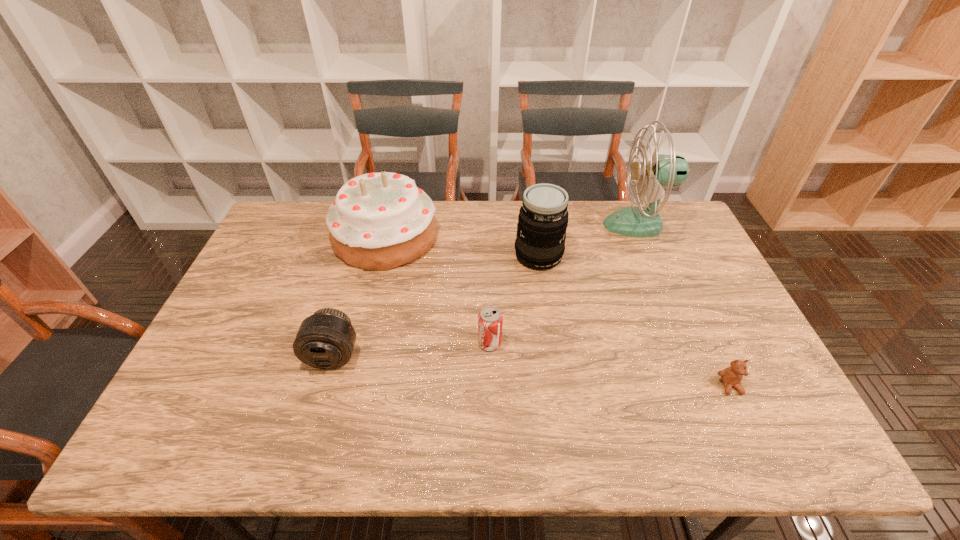
In order to click on object that is the third closest one to the soda can in this screenshot , I will do `click(325, 340)`.

Locate an element on the screen. vacant space that satisfies the following two spatial constraints: 1. in front of the tallest object, directing airflow; 2. on the front-facing side of the left telephoto lens is located at coordinates (692, 355).

Find the location of `vacant region that satisfies the following two spatial constraints: 1. in front of the tallest object, directing airflow; 2. on the front side of the cake`. vacant region that satisfies the following two spatial constraints: 1. in front of the tallest object, directing airflow; 2. on the front side of the cake is located at coordinates (642, 237).